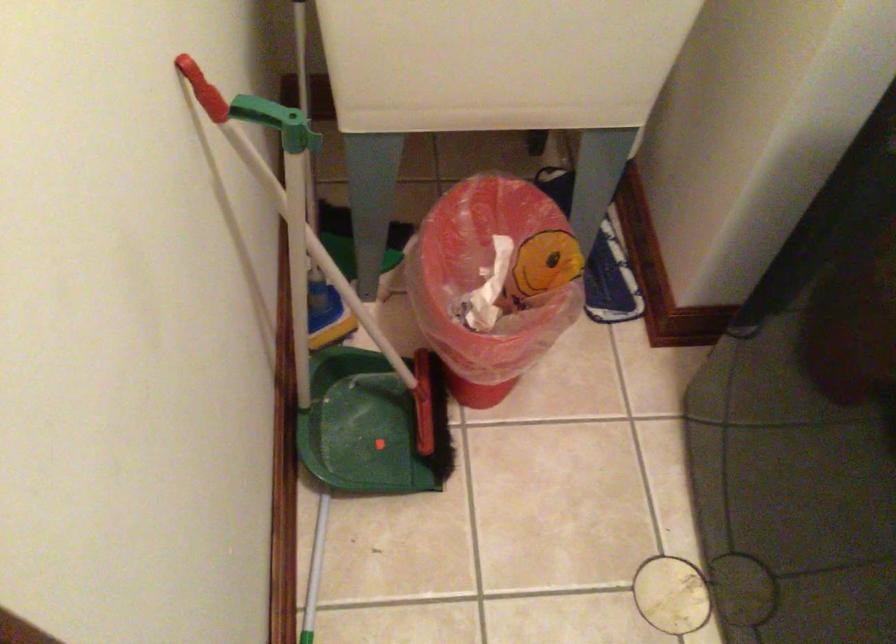
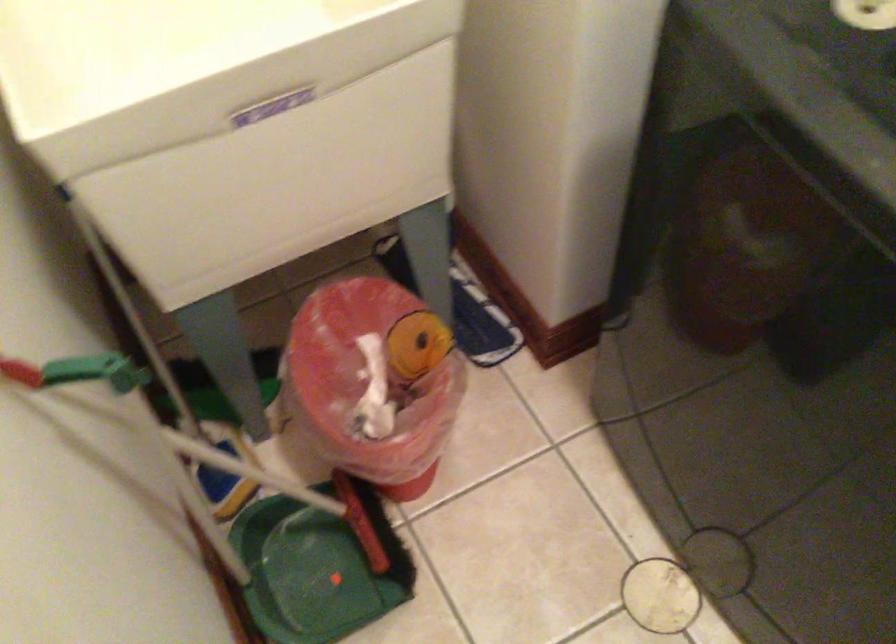
Where in the second image is the point corresponding to point (494, 277) from the first image?

(375, 377)